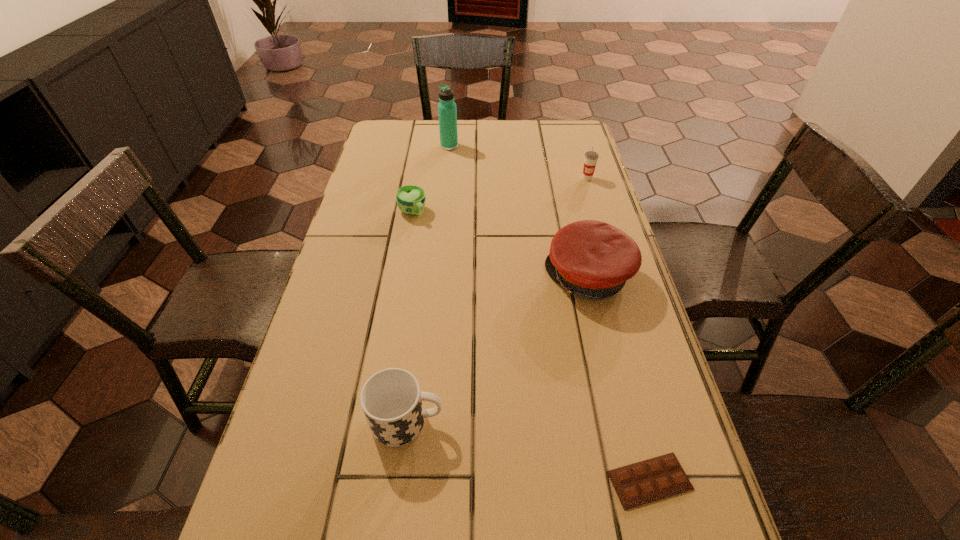
Where is `empty space that is in between the shortest cup and the cap`? empty space that is in between the shortest cup and the cap is located at coordinates (500, 245).

Image resolution: width=960 pixels, height=540 pixels. What are the coordinates of `blank region between the cap and the fifth farthest object` in the screenshot? It's located at (498, 349).

Where is `blank region between the chocolate bar and the third nearest object`? The width and height of the screenshot is (960, 540). blank region between the chocolate bar and the third nearest object is located at coordinates (619, 379).

I want to click on object that is the nearest to the nearest cup, so click(640, 483).

Identify which object is the third closest to the nearest cup. Please provide its 2D coordinates. Your answer should be formatted as a tuple, i.e. [(x, y)], where the tuple contains the x and y coordinates of a point satisfying the conditions above.

[(410, 199)]

Identify which cup is the second nearest to the rightmost cup. Please provide its 2D coordinates. Your answer should be formatted as a tuple, i.e. [(x, y)], where the tuple contains the x and y coordinates of a point satisfying the conditions above.

[(391, 399)]

Find the location of `the third closest cup relative to the shortest object`. the third closest cup relative to the shortest object is located at coordinates tap(591, 157).

This screenshot has height=540, width=960. In order to click on free location that satisfies the following two spatial constraints: 1. on the front side of the tallest object; 2. on the side of the nearest cup with the handle in this screenshot , I will do `click(423, 421)`.

You are a GUI agent. You are given a task and a screenshot of the screen. Output one action in this format:
    pyautogui.click(x=<x>, y=<y>)
    Task: Click on the free space that satisfies the following two spatial constraints: 1. on the back side of the chocolate bar; 2. at the front of the cap where the visor is located
    
    Given the screenshot: What is the action you would take?
    point(597,277)

Identify the location of vacant space that satisfies the following two spatial constraints: 1. at the front of the cap where the visor is located; 2. on the left side of the chocolate bar. (637, 480).